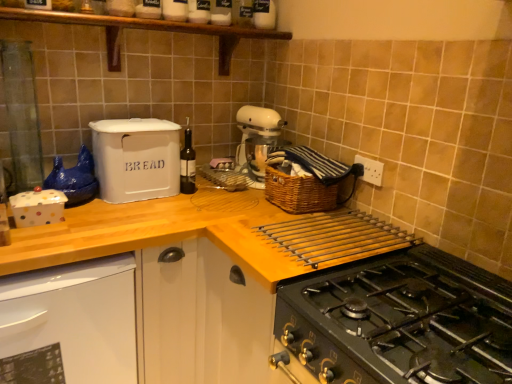
Question: Does woven brown basket at upper right come in front of wooden at upper center?

Choices:
 (A) no
 (B) yes

Answer: (A)

Question: Is woven brown basket at upper right bigger than wooden at upper center?

Choices:
 (A) no
 (B) yes

Answer: (A)

Question: Is woven brown basket at upper right outside of wooden at upper center?

Choices:
 (A) yes
 (B) no

Answer: (A)

Question: From a real-world perspective, is woven brown basket at upper right positioned under wooden at upper center based on gravity?

Choices:
 (A) yes
 (B) no

Answer: (B)

Question: Is woven brown basket at upper right turned away from wooden at upper center?

Choices:
 (A) yes
 (B) no

Answer: (B)

Question: Visually, is wooden shelf at upper center positioned to the left or to the right of woven brown basket at upper right?

Choices:
 (A) right
 (B) left

Answer: (B)

Question: From their relative heights in the image, would you say wooden shelf at upper center is taller or shorter than woven brown basket at upper right?

Choices:
 (A) short
 (B) tall

Answer: (B)

Question: Considering the positions of point (41, 19) and point (285, 210), is point (41, 19) closer or farther from the camera than point (285, 210)?

Choices:
 (A) closer
 (B) farther

Answer: (A)

Question: Considering the positions of wooden shelf at upper center and woven brown basket at upper right in the image, is wooden shelf at upper center wider or thinner than woven brown basket at upper right?

Choices:
 (A) wide
 (B) thin

Answer: (B)

Question: In the image, is wooden shelf at upper center positioned in front of or behind white matte bread bin at upper left?

Choices:
 (A) behind
 (B) front

Answer: (B)

Question: In terms of width, does wooden shelf at upper center look wider or thinner when compared to white matte bread bin at upper left?

Choices:
 (A) thin
 (B) wide

Answer: (A)

Question: Is wooden shelf at upper center bigger or smaller than white matte bread bin at upper left?

Choices:
 (A) big
 (B) small

Answer: (A)

Question: In terms of height, does wooden shelf at upper center look taller or shorter compared to white matte bread bin at upper left?

Choices:
 (A) short
 (B) tall

Answer: (A)

Question: From the image's perspective, is wooden shelf at upper center above or below black matte gas stove at lower right?

Choices:
 (A) above
 (B) below

Answer: (A)

Question: Is wooden shelf at upper center spatially inside black matte gas stove at lower right, or outside of it?

Choices:
 (A) outside
 (B) inside

Answer: (A)